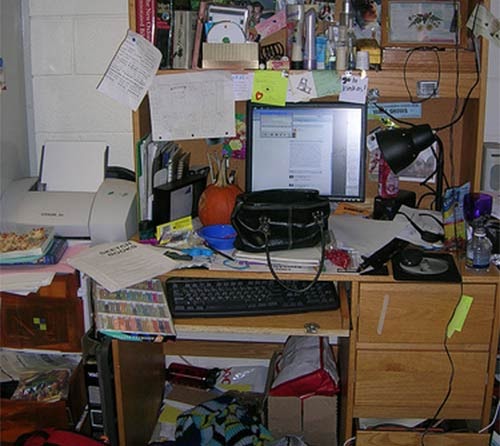
Locate an element on the screen. The height and width of the screenshot is (446, 500). papers is located at coordinates (127, 267), (130, 79), (179, 100), (361, 226), (426, 223).